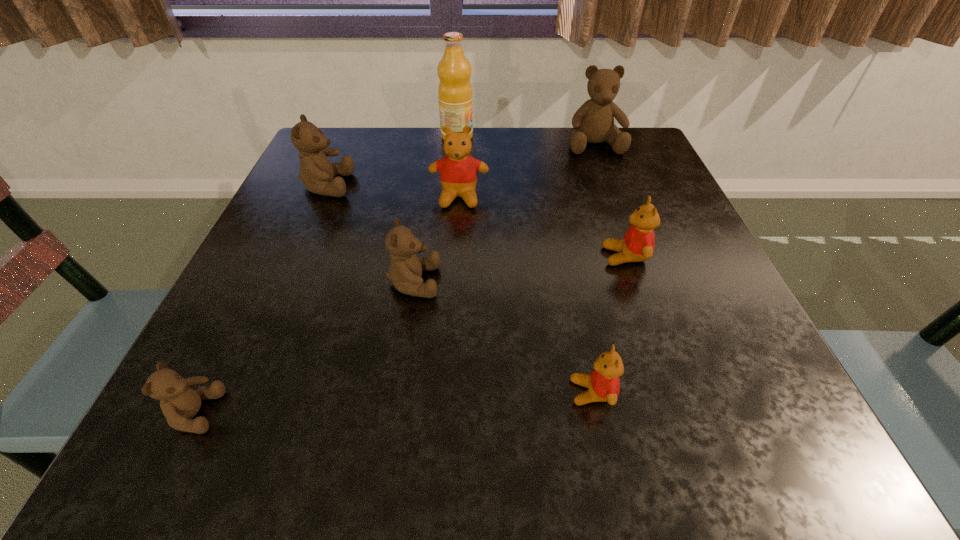
The width and height of the screenshot is (960, 540). Find the location of `vacant space at the left edge of the desktop`. vacant space at the left edge of the desktop is located at coordinates (277, 226).

I want to click on free space at the right edge, so click(x=663, y=233).

Locate an element on the screen. vacant region at the far left corner of the desktop is located at coordinates (349, 127).

Image resolution: width=960 pixels, height=540 pixels. Identify the location of free area in between the rightmost red teddy bear and the tallest teddy bear. (610, 200).

Identify the location of unoccupied position between the farthest red teddy bear and the biggest brown teddy bear. (527, 171).

Identify the location of free spot between the nearest brown teddy bear and the second biggest brown teddy bear. (261, 299).

I want to click on free point between the smallest brown teddy bear and the second brown teddy bear from right to left, so click(304, 347).

In order to click on vacant area between the rightmost brown teddy bear and the third biggest brown teddy bear in this screenshot , I will do `click(504, 213)`.

At what (x,y) coordinates should I click in order to perform the action: click on free space between the second biggest red teddy bear and the second nearest brown teddy bear. Please return your answer as a coordinate pair (x, y). The image size is (960, 540). Looking at the image, I should click on (519, 269).

I want to click on vacant space that is in between the second biggest brown teddy bear and the second nearest red teddy bear, so click(476, 221).